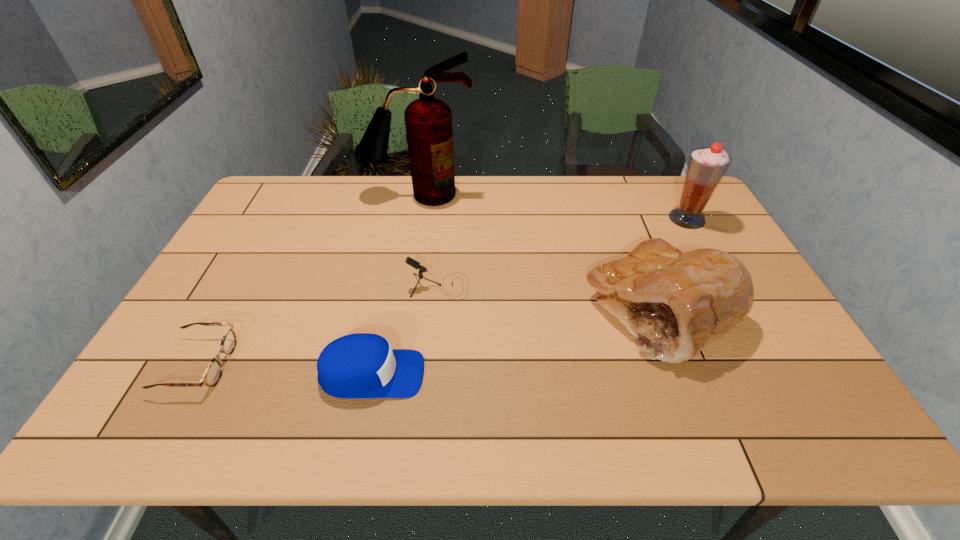
This screenshot has width=960, height=540. Identify the location of the tallest object. [428, 120].

Where is `fire extinguisher`? The width and height of the screenshot is (960, 540). fire extinguisher is located at coordinates (428, 120).

Image resolution: width=960 pixels, height=540 pixels. I want to click on the second tallest object, so click(x=706, y=167).

Identify the location of the fifth nearest object. (706, 167).

I want to click on the third tallest object, so click(x=675, y=303).

At what (x,y) coordinates should I click in order to perform the action: click on microphone. Please return your answer as a coordinate pair (x, y). The image size is (960, 540). Looking at the image, I should click on coord(415,264).

The width and height of the screenshot is (960, 540). Identify the location of baseball cap. (362, 365).

Find the location of a particular element. The image size is (960, 540). the leftmost object is located at coordinates (213, 372).

At what (x,y) coordinates should I click in order to perform the action: click on spectacles. Please return your answer as a coordinate pair (x, y). This screenshot has height=540, width=960. Looking at the image, I should click on (213, 372).

This screenshot has width=960, height=540. Find the location of `free space located 0.120m at the nozzle of the tallest object`. free space located 0.120m at the nozzle of the tallest object is located at coordinates (414, 229).